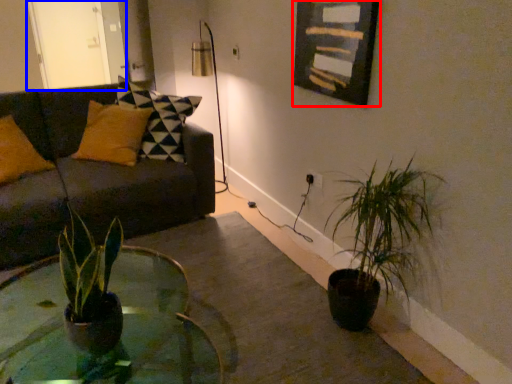
Question: Which of the following is the closest to the observer, picture frame (highlighted by a red box) or glass door (highlighted by a blue box)?

Choices:
 (A) picture frame
 (B) glass door

Answer: (A)